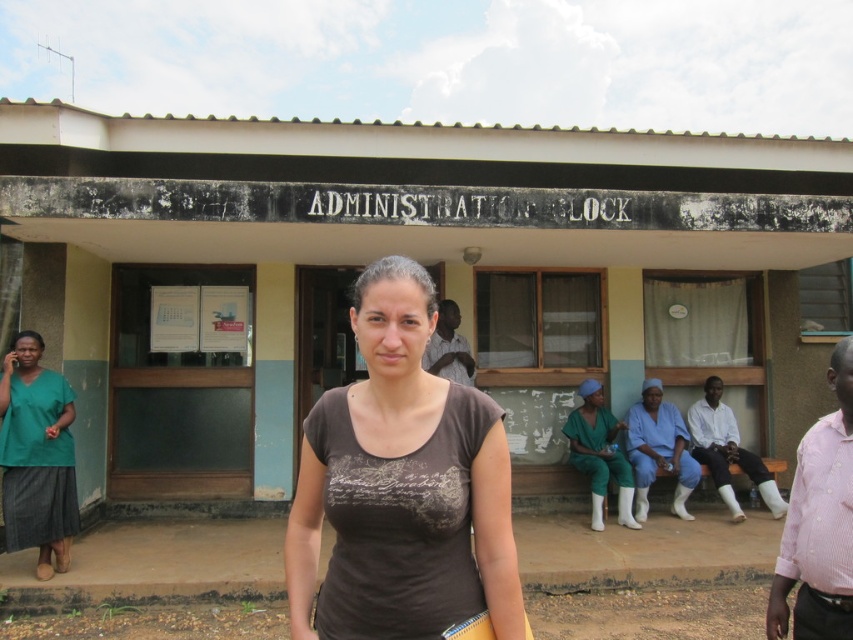
Does point (827, 458) come in front of point (602, 433)?

Yes, it is in front of point (602, 433).

Which is in front, point (833, 554) or point (584, 424)?

Point (833, 554) is more forward.

The width and height of the screenshot is (853, 640). I want to click on pink checkered shirt at right, so point(819,524).

Who is more forward, (22,429) or (730,490)?

Point (22,429) is more forward.

Does green fabric shirt at left come behind white cotton socks at lower right?

No, green fabric shirt at left is in front of white cotton socks at lower right.

Is point (22, 349) farther from camera compared to point (705, 461)?

That is False.

Identify the location of green fabric shirt at left. Image resolution: width=853 pixels, height=640 pixels. (38, 456).

From the picture: Is green fabric shirt at left taller than blue scrubs at center?

Indeed, green fabric shirt at left has a greater height compared to blue scrubs at center.

Can you confirm if green fabric shirt at left is positioned above blue scrubs at center?

Yes, green fabric shirt at left is above blue scrubs at center.

This screenshot has height=640, width=853. I want to click on green fabric shirt at left, so click(x=38, y=456).